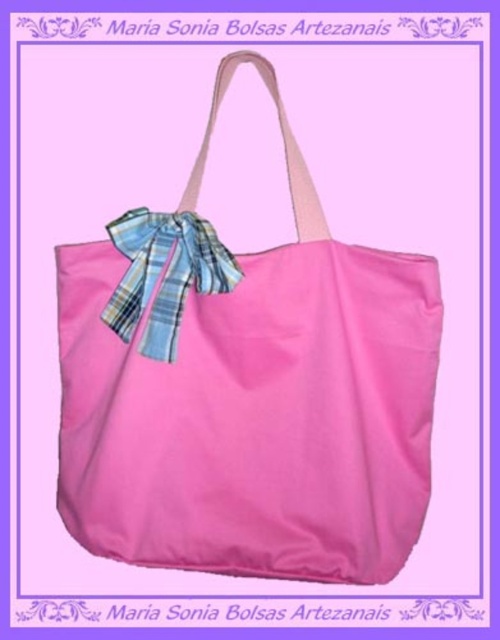
Who is taller, matte pink fabric shoulder bag at center or plaid fabric bow at center?

With more height is matte pink fabric shoulder bag at center.

Between point (116, 221) and point (183, 291), which one is positioned behind?

The point (183, 291) is more distant.

Locate an element on the screen. The height and width of the screenshot is (640, 500). matte pink fabric shoulder bag at center is located at coordinates (246, 390).